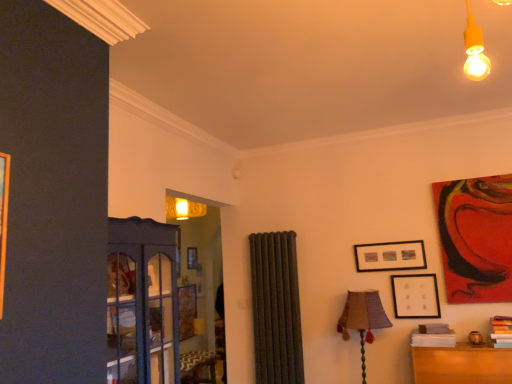
Question: From a real-world perspective, is hardcover book at lower right, placed as the 1th book when sorted from right to left, physically located above or below burlap lampshade at center-right?

Choices:
 (A) above
 (B) below

Answer: (A)

Question: Considering the relative positions of hardcover book at lower right, placed as the 1th book when sorted from right to left, and burlap lampshade at center-right in the image provided, is hardcover book at lower right, placed as the 1th book when sorted from right to left, to the left or to the right of burlap lampshade at center-right?

Choices:
 (A) left
 (B) right

Answer: (B)

Question: Estimate the real-world distances between objects in this image. Which object is farther from the red glossy painting at upper right, the first picture frame from the right?

Choices:
 (A) black matte picture frame at upper right, which is counted as the third picture frame, starting from the right
 (B) white paper at lower right, arranged as the first book when viewed from the left
 (C) hardcover book at lower right, placed as the 1th book when sorted from right to left
 (D) burlap lampshade at center-right
 (E) matte black picture frame at lower right, marked as the second picture frame in a right-to-left arrangement

Answer: (D)

Question: Which is nearer to the white paper at lower right, arranged as the first book when viewed from the left?

Choices:
 (A) black matte picture frame at upper right, which is counted as the third picture frame, starting from the right
 (B) red glossy painting at upper right, the first picture frame from the right
 (C) burlap lampshade at center-right
 (D) matte black picture frame at lower right, the second picture frame viewed from the left
 (E) hardcover book at lower right, which is counted as the second book, starting from the left

Answer: (D)